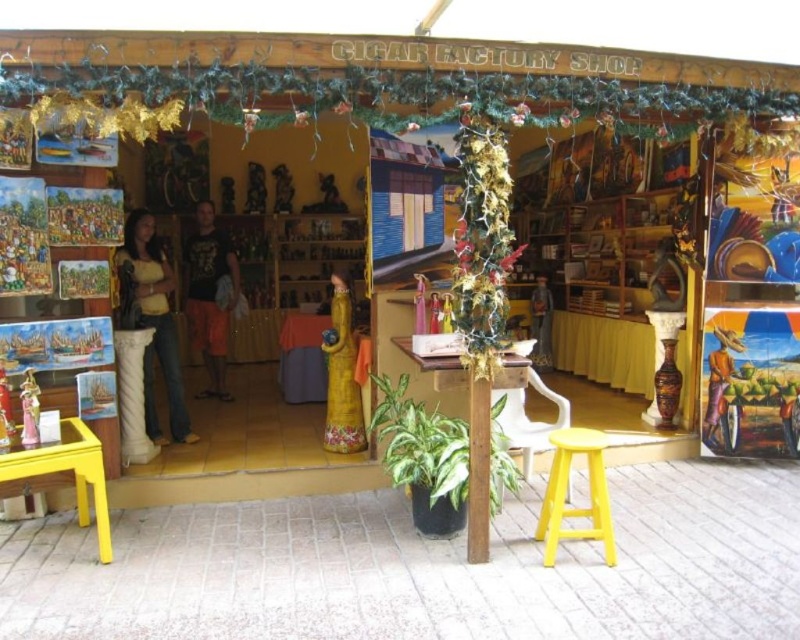
Is yellow plastic stool at lower center to the left of wooden statue at center from the viewer's perspective?

Incorrect, yellow plastic stool at lower center is not on the left side of wooden statue at center.

Does yellow plastic stool at lower center have a greater width compared to wooden statue at center?

Yes.

Does point (601, 481) come in front of point (336, 273)?

Yes, point (601, 481) is closer to viewer.

This screenshot has height=640, width=800. I want to click on yellow plastic stool at lower center, so click(566, 490).

Who is higher up, jeans at left or orange cotton shorts at center?

orange cotton shorts at center

Measure the distance between jeans at left and camera.

A distance of 4.68 meters exists between jeans at left and camera.

Where is `jeans at left`? This screenshot has height=640, width=800. jeans at left is located at coordinates (152, 321).

Does point (222, 400) lie in front of point (558, 432)?

No, (222, 400) is behind (558, 432).

Which is in front, point (220, 390) or point (541, 532)?

Point (541, 532)

Where is `orange cotton shorts at center`? orange cotton shorts at center is located at coordinates (210, 294).